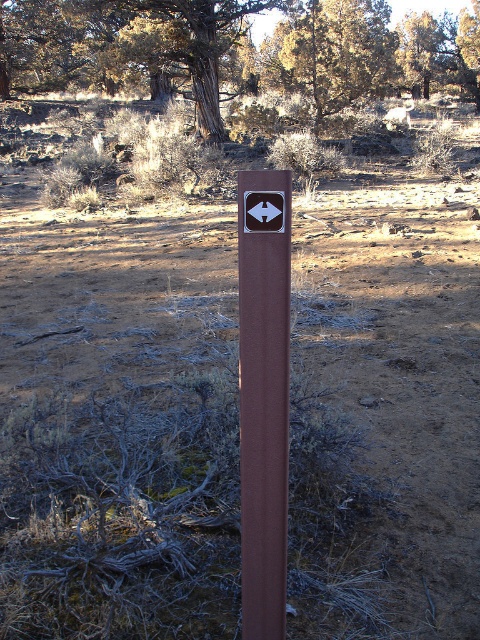
You are standing on the brown dirt field at center and looking towards the brown polished post at center. Which object is taller from your perspective?

A: The brown polished post at center is taller than the brown dirt field at center.